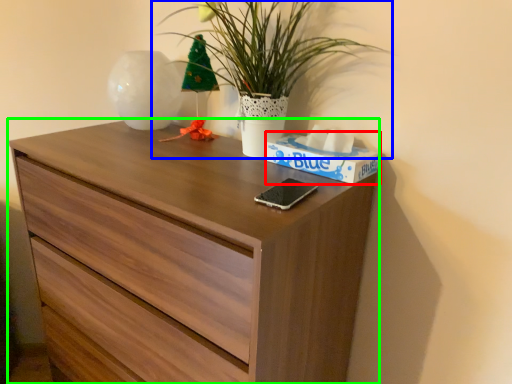
Question: Which object is the closest to the box (highlighted by a red box)? Choose among these: houseplant (highlighted by a blue box) or chest of drawers (highlighted by a green box).

Choices:
 (A) houseplant
 (B) chest of drawers

Answer: (A)